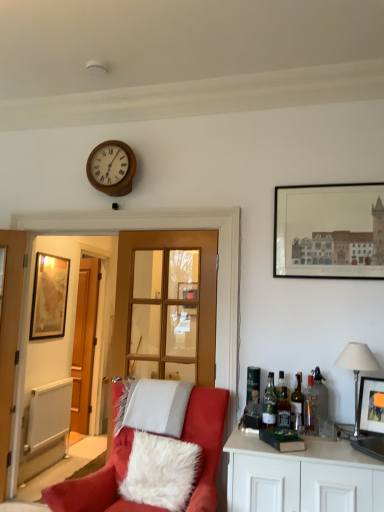
Question: Is silver metallic lampshade at right taller or shorter than translucent glass bottle at right, the 4th bottle from the left?

Choices:
 (A) tall
 (B) short

Answer: (A)

Question: Is silver metallic lampshade at right in front of or behind translucent glass bottle at right, the 3th bottle from the right, in the image?

Choices:
 (A) behind
 (B) front

Answer: (B)

Question: Which is farther from the white fluffy pillow at lower center, the second pillow from the back?

Choices:
 (A) translucent glass bottle at right, arranged as the first bottle when viewed from the left
 (B) wooden door at left
 (C) suede red chair at lower left
 (D) green glass bottle at right, which is counted as the 4th bottle, starting from the right
 (E) clear glass wine bottle at right

Answer: (B)

Question: Which is farther from the wooden door at left?

Choices:
 (A) translucent glass bottle at right, the 3th bottle from the right
 (B) silver metallic lampshade at right
 (C) suede red chair at lower left
 (D) clear glass bottle at right, which ranks as the sixth bottle in left-to-right order
 (E) white textured radiator at lower left

Answer: (B)